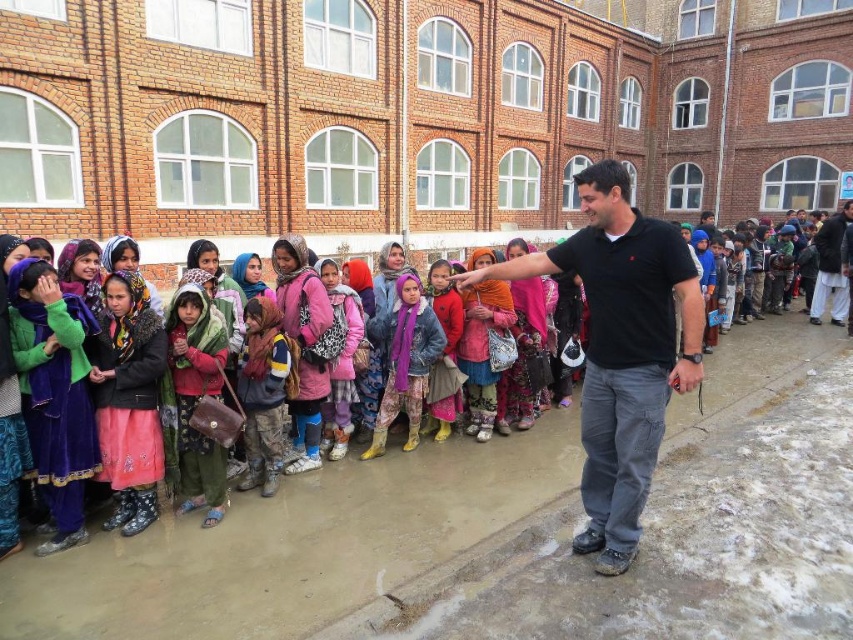
Based on the scene description, which object is shorter between the black cotton shirt at center and the dark brown woolen suit at right?

The black cotton shirt at center is shorter than the dark brown woolen suit at right.

You are a photographer trying to capture a closeup of the green fabric scarf at left and the pink fabric scarf at center. Which scarf should you zoom in on to ensure both are visible in the frame without moving the camera?

The green fabric scarf at left might be wider than the pink fabric scarf at center, so you should zoom in on the pink fabric scarf at center to ensure both are visible without moving the camera.